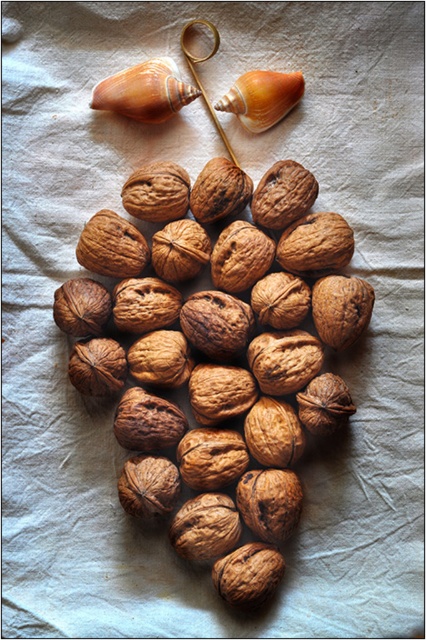
Does matte brown shell at upper left have a lesser height compared to matte brown seashell at upper center?

Incorrect, matte brown shell at upper left's height does not fall short of matte brown seashell at upper center's.

Measure the distance between matte brown shell at upper left and matte brown seashell at upper center.

matte brown shell at upper left and matte brown seashell at upper center are 5.72 inches apart from each other.

Between point (193, 93) and point (224, 104), which one is positioned behind?

The point (224, 104) is more distant.

I want to click on matte brown shell at upper left, so click(144, 92).